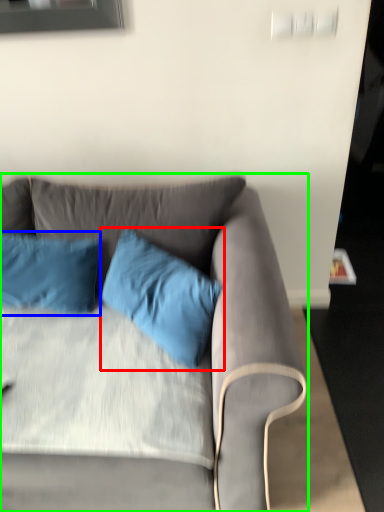
Question: Based on their relative distances, which object is farther from pillow (highlighted by a red box)? Choose from pillow (highlighted by a blue box) and studio couch (highlighted by a green box).

Choices:
 (A) pillow
 (B) studio couch

Answer: (A)